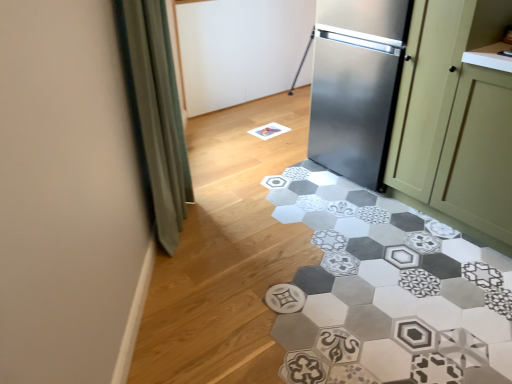
I want to click on empty space that is ontop of gray hexagonal tile at center (from a real-world perspective), so click(307, 284).